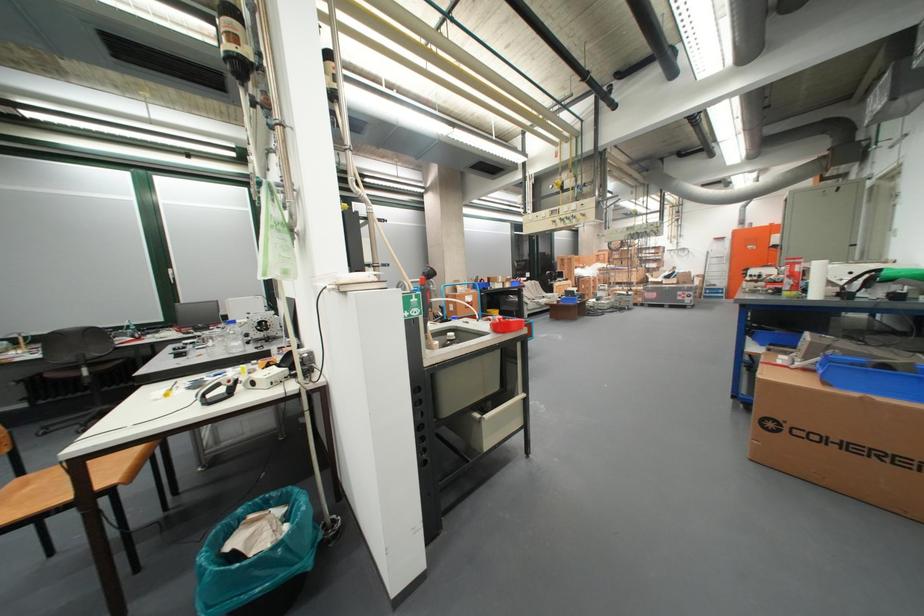
At what (x,y) coordinates should I click in order to perform the action: click on red faucet handle. Please return your answer as a coordinate pair (x, y). The image size is (924, 616). Looking at the image, I should click on (x=427, y=276).